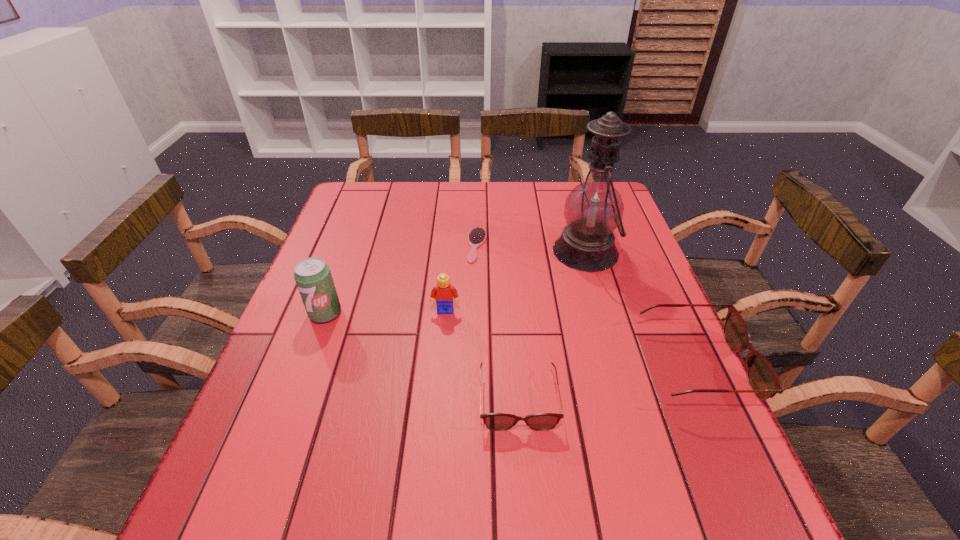
Please show where to add a spectacles on the left while keeping spacing even. Please provide its 2D coordinates. Your answer should be formatted as a tuple, i.e. [(x, y)], where the tuple contains the x and y coordinates of a point satisfying the conditions above.

[(314, 440)]